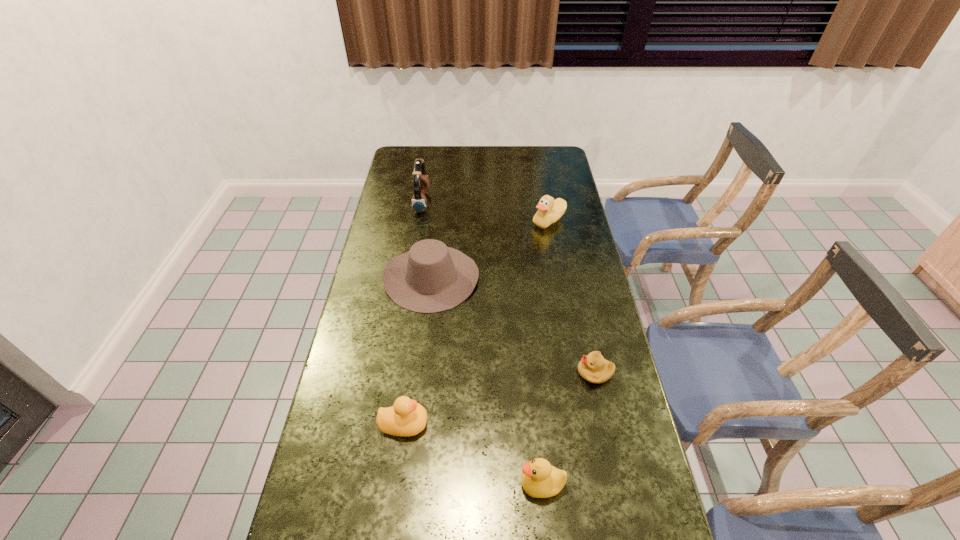
Where is `vacant space located at the beak of the farthest duck`? The image size is (960, 540). vacant space located at the beak of the farthest duck is located at coordinates (473, 221).

You are a GUI agent. You are given a task and a screenshot of the screen. Output one action in this format:
    pyautogui.click(x=<x>, y=<y>)
    Task: Click on the vacant space located at the beak of the farthest duck
    The height and width of the screenshot is (540, 960).
    Given the screenshot: What is the action you would take?
    pyautogui.click(x=512, y=221)

Where is `vacant point located at the beak of the farthest duck`? The height and width of the screenshot is (540, 960). vacant point located at the beak of the farthest duck is located at coordinates (479, 221).

This screenshot has height=540, width=960. I want to click on vacant space located 0.360m on the right of the cowboy hat, so click(x=583, y=277).

Identify the location of free space located on the face of the leftmost duck. (555, 423).

Identify the location of vacant space positioned 0.160m at the beak of the fourth object from left to right. [x=452, y=484].

Image resolution: width=960 pixels, height=540 pixels. In order to click on vacant space situated at the beak of the fourth object from left to right in this screenshot , I will do `click(380, 484)`.

What are the coordinates of `free spot located 0.090m at the beak of the fourth object from left to right` in the screenshot? It's located at (482, 484).

This screenshot has width=960, height=540. What are the coordinates of `blank area located 0.080m on the front-facing side of the duckling` in the screenshot? It's located at (549, 373).

The image size is (960, 540). What are the coordinates of `vacant space located on the front-facing side of the duckling` in the screenshot? It's located at (465, 373).